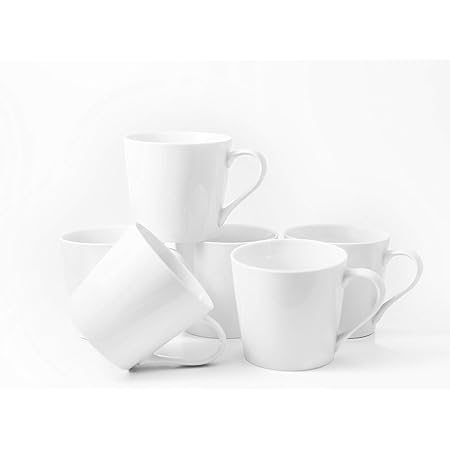
Locate an element on the screen. This screenshot has height=450, width=450. cups is located at coordinates (86, 257), (130, 300), (182, 177), (216, 260), (285, 296), (367, 243).